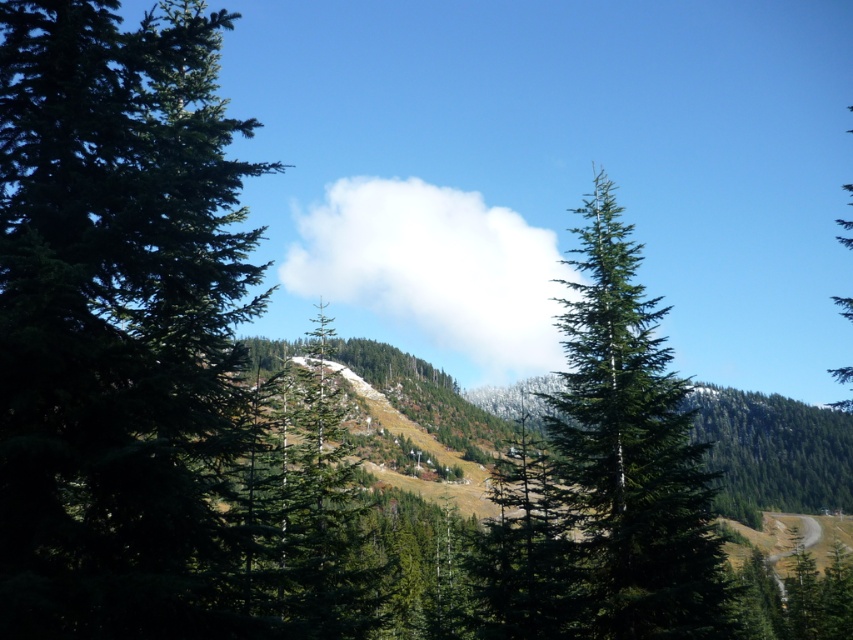
Question: Where is white fluffy cloud at center located in relation to green matte tree at right in the image?

Choices:
 (A) left
 (B) right

Answer: (A)

Question: Does green matte tree at center appear over green matte tree at right?

Choices:
 (A) no
 (B) yes

Answer: (A)

Question: Is green matte tree at center bigger than white fluffy cloud at center?

Choices:
 (A) yes
 (B) no

Answer: (A)

Question: Which point is farther to the camera?

Choices:
 (A) (415, 189)
 (B) (697, 556)

Answer: (A)

Question: Which object is positioned closest to the white fluffy cloud at center?

Choices:
 (A) green matte tree at right
 (B) green matte tree at center

Answer: (B)

Question: Which of the following is the closest to the observer?

Choices:
 (A) green matte tree at right
 (B) white fluffy cloud at center
 (C) green matte tree at center

Answer: (C)